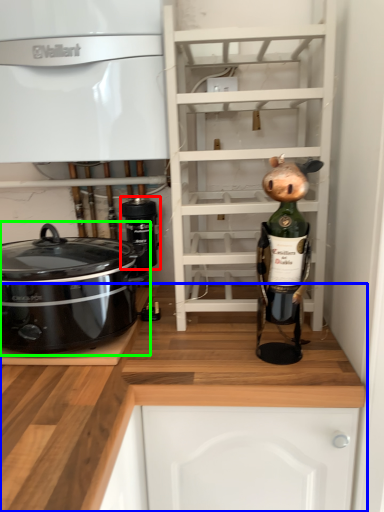
Question: Which is nearer to the appliance (highlighted by a red box)? cabinetry (highlighted by a blue box) or home appliance (highlighted by a green box).

Choices:
 (A) cabinetry
 (B) home appliance

Answer: (B)